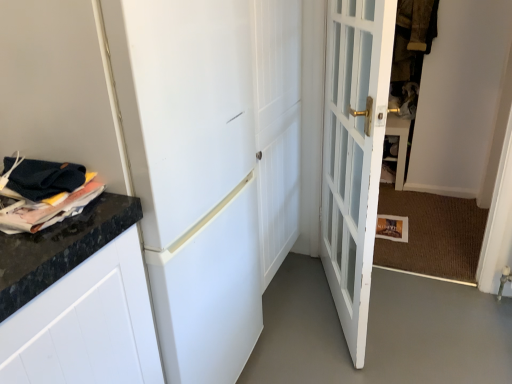
This screenshot has height=384, width=512. Identify the location of vacant area that is situated to the right of white glass door at center, acting as the 1th door starting from the right. (429, 316).